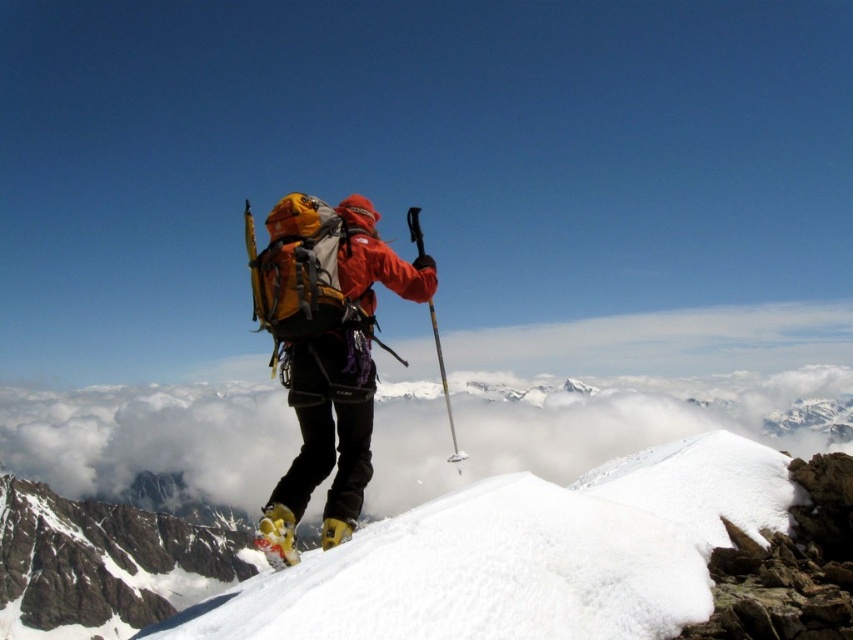
Does matte orange jacket at center have a greater height compared to yellow metallic ski pole at center?

No.

Between matte orange jacket at center and yellow metallic ski pole at center, which one has less height?

Standing shorter between the two is matte orange jacket at center.

Find the location of `matte orange jacket at center`. matte orange jacket at center is located at coordinates (325, 353).

You are a GUI agent. You are given a task and a screenshot of the screen. Output one action in this format:
    pyautogui.click(x=<x>, y=<y>)
    Task: Click on the matte orange jacket at center
    
    Given the screenshot: What is the action you would take?
    pyautogui.click(x=325, y=353)

In the scene shown: Does matte orange jacket at center appear on the right side of yellow matte ski at center?

Correct, you'll find matte orange jacket at center to the right of yellow matte ski at center.

Is matte orange jacket at center to the left of yellow matte ski at center from the viewer's perspective?

In fact, matte orange jacket at center is to the right of yellow matte ski at center.

Which is in front, point (325, 392) or point (337, 524)?

Positioned in front is point (337, 524).

Identify the location of matte orange jacket at center. (325, 353).

This screenshot has height=640, width=853. What do you see at coordinates (276, 536) in the screenshot?
I see `yellow matte ski at center` at bounding box center [276, 536].

Does point (282, 536) come in front of point (444, 392)?

Yes, point (282, 536) is closer to viewer.

Locate an element on the screen. yellow matte ski at center is located at coordinates (276, 536).